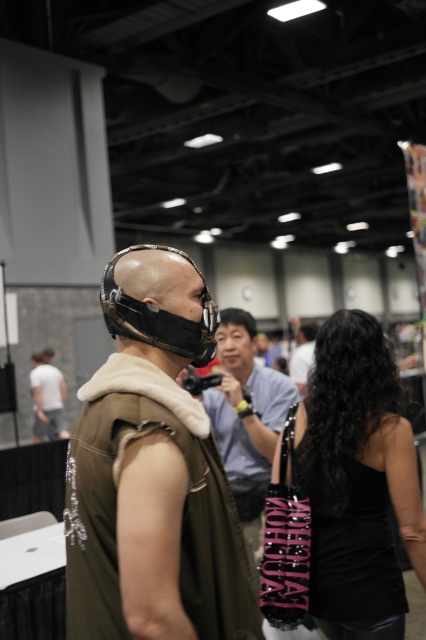
Question: Does leather-like brown vest at center appear on the right side of black matte/glossy goggles at upper left?

Choices:
 (A) no
 (B) yes

Answer: (B)

Question: Which point appears farthest from the camera in this image?

Choices:
 (A) (362, 401)
 (B) (244, 506)
 (C) (166, 342)
 (D) (62, 416)

Answer: (D)

Question: Observing the image, what is the correct spatial positioning of matte black mask at center in reference to black matte vest at center?

Choices:
 (A) left
 (B) right

Answer: (A)

Question: Which point is closer to the camera?

Choices:
 (A) matte black mask at center
 (B) leather-like brown vest at center

Answer: (B)

Question: Which object appears farthest from the camera in this image?

Choices:
 (A) light gray cotton t-shirt at center
 (B) matte black mask at center
 (C) leather-like brown vest at center

Answer: (A)

Question: Does black matte/glossy goggles at upper left appear over black matte vest at center?

Choices:
 (A) no
 (B) yes

Answer: (B)